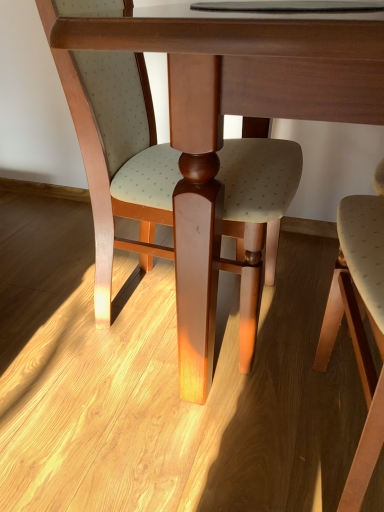
Where is `matte wood chair at center`? The height and width of the screenshot is (512, 384). matte wood chair at center is located at coordinates (178, 191).

What do you see at coordinates (178, 191) in the screenshot? I see `matte wood chair at center` at bounding box center [178, 191].

Identify the location of matte wood chair at center. (178, 191).